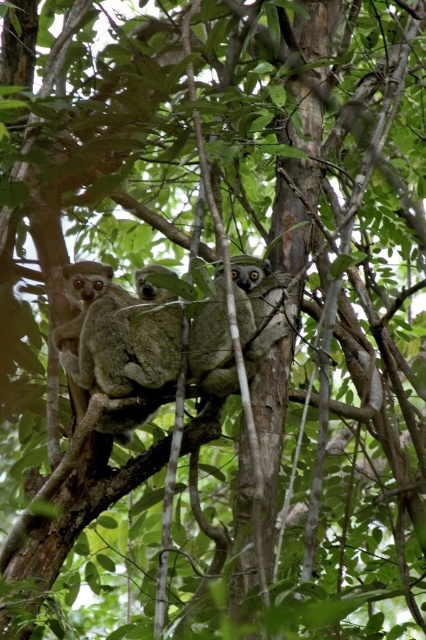
Question: Can you confirm if soft brown fur at left is positioned below gray furry koala at center?

Choices:
 (A) no
 (B) yes

Answer: (B)

Question: Which point is closer to the camera taking this photo?

Choices:
 (A) (89, 262)
 (B) (189, 358)

Answer: (A)

Question: Among these points, which one is nearest to the camera?

Choices:
 (A) pyautogui.click(x=129, y=435)
 (B) pyautogui.click(x=204, y=365)

Answer: (B)

Question: From the image, what is the correct spatial relationship of soft brown fur at left in relation to gray furry koala at center?

Choices:
 (A) below
 (B) above

Answer: (A)

Question: Can you confirm if soft brown fur at left is positioned above gray furry koala at center?

Choices:
 (A) yes
 (B) no

Answer: (B)